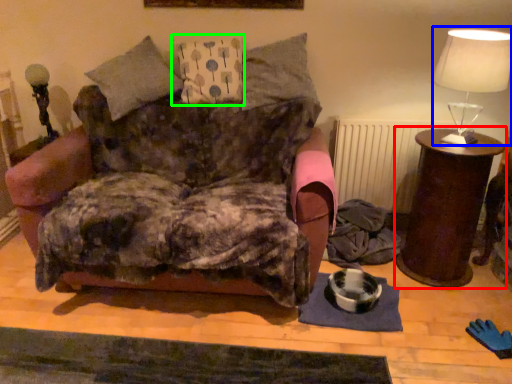
Question: Estimate the real-world distances between objects in this image. Which object is farther from nightstand (highlighted by a red box), table lamp (highlighted by a blue box) or pillow (highlighted by a green box)?

Choices:
 (A) table lamp
 (B) pillow

Answer: (B)